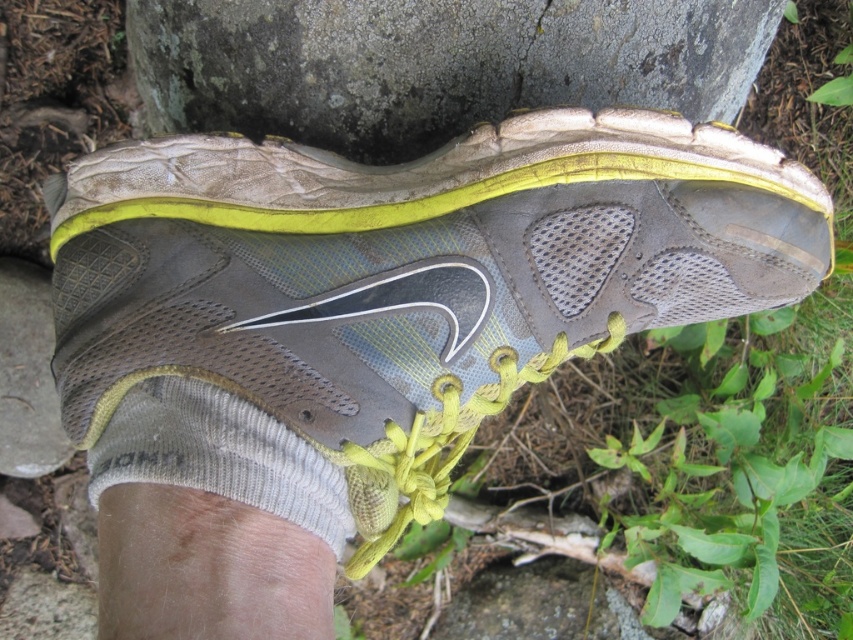
Is point (73, 342) more distant than point (235, 12)?

No, (73, 342) is closer to viewer.

Who is positioned more to the right, matte gray running shoe at center or gray rough stone at center?

Positioned to the right is matte gray running shoe at center.

Image resolution: width=853 pixels, height=640 pixels. Find the location of `matte gray running shoe at center`. matte gray running shoe at center is located at coordinates (396, 273).